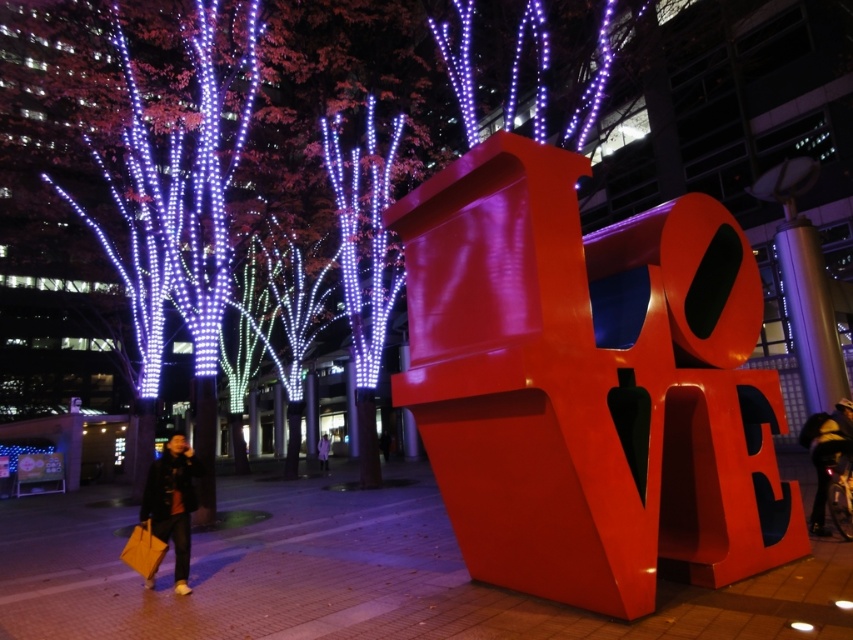
Question: Can you confirm if dark blue leather jacket at lower right is positioned below purple fabric coat at lower left?

Choices:
 (A) yes
 (B) no

Answer: (B)

Question: Estimate the real-world distances between objects in this image. Which object is farther from the dark blue leather jacket at lower right?

Choices:
 (A) purple fabric coat at lower left
 (B) dark brown leather jacket at lower left

Answer: (A)

Question: Does dark brown leather jacket at lower left have a larger size compared to purple fabric coat at lower left?

Choices:
 (A) yes
 (B) no

Answer: (B)

Question: Which of the following is the closest to the observer?

Choices:
 (A) (160, 492)
 (B) (320, 464)
 (C) (805, 436)

Answer: (A)

Question: Estimate the real-world distances between objects in this image. Which object is closer to the dark blue leather jacket at lower right?

Choices:
 (A) purple fabric coat at lower left
 (B) dark brown leather jacket at lower left

Answer: (B)

Question: Does dark brown leather jacket at lower left come behind purple fabric coat at lower left?

Choices:
 (A) no
 (B) yes

Answer: (A)